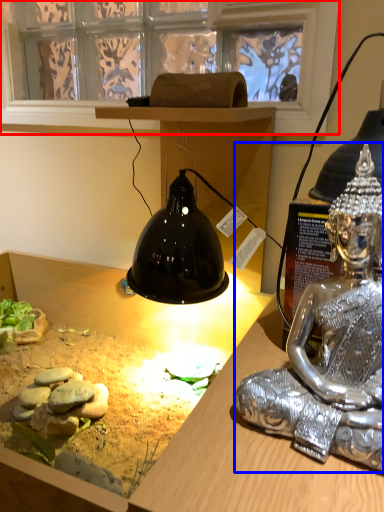
Question: Which point is further to the camera, window screen (highlighted by a red box) or person (highlighted by a blue box)?

Choices:
 (A) window screen
 (B) person

Answer: (A)